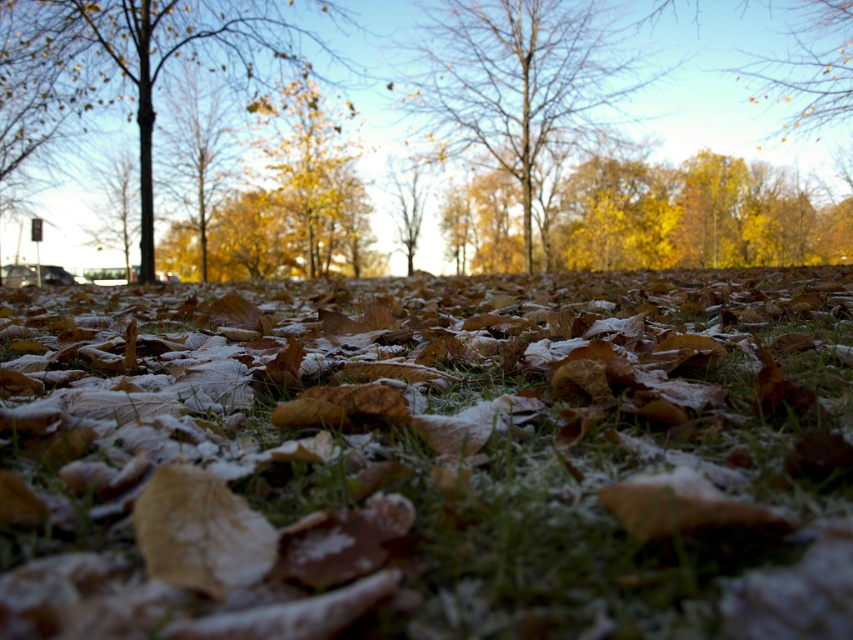
Question: Which point is farther from the camera taking this photo?

Choices:
 (A) (795, 80)
 (B) (502, 19)
 (C) (73, 86)

Answer: (B)

Question: Is frosted green grass at center above bare branches at center?

Choices:
 (A) yes
 (B) no

Answer: (B)

Question: Does frosted green grass at center have a lesser width compared to yellow matte leaves at upper center?

Choices:
 (A) no
 (B) yes

Answer: (A)

Question: Does bare branches at center appear under yellow matte leaves at upper center?

Choices:
 (A) no
 (B) yes

Answer: (A)

Question: Which object is farther from the camera taking this photo?

Choices:
 (A) brown wood tree at left
 (B) bare branches at center
 (C) yellow matte leaves at upper center
 (D) frosted green grass at center

Answer: (B)

Question: Which point appears closest to the camera in this image?

Choices:
 (A) (138, 168)
 (B) (831, 83)

Answer: (A)